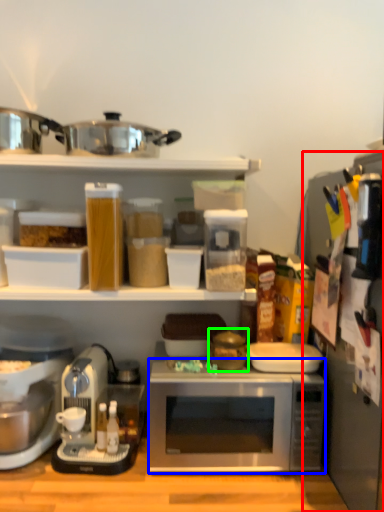
Question: Considering the real-world distances, which object is farthest from appliance (highlighted by a red box)? microwave oven (highlighted by a blue box) or appliance (highlighted by a green box)?

Choices:
 (A) microwave oven
 (B) appliance

Answer: (B)